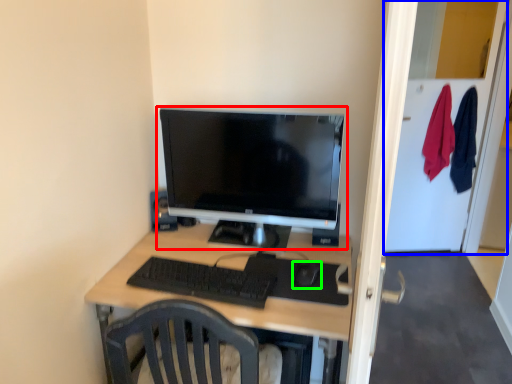
Question: Based on their relative distances, which object is nearer to computer monitor (highlighted by a red box)? Choose from glass door (highlighted by a blue box) and mouse (highlighted by a green box).

Choices:
 (A) glass door
 (B) mouse

Answer: (B)